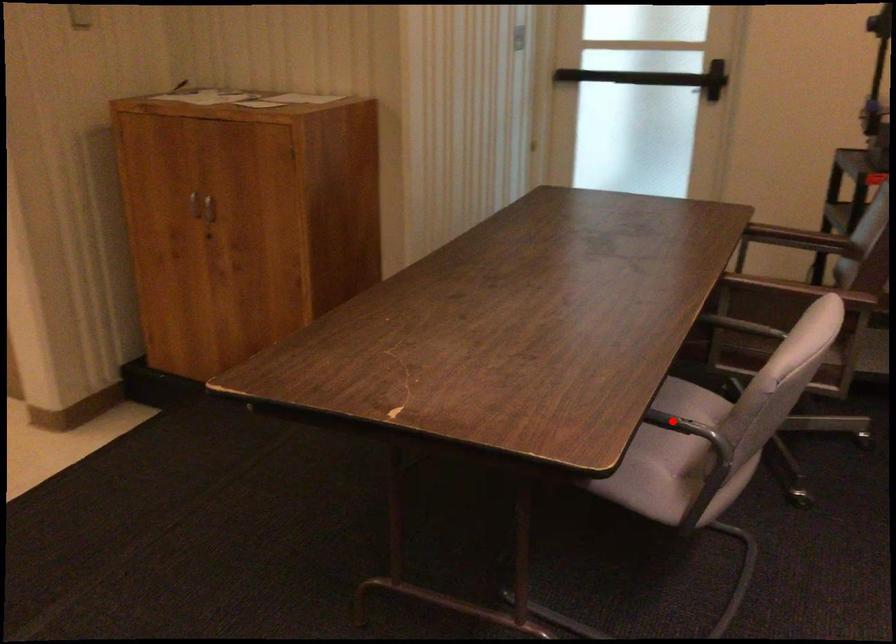
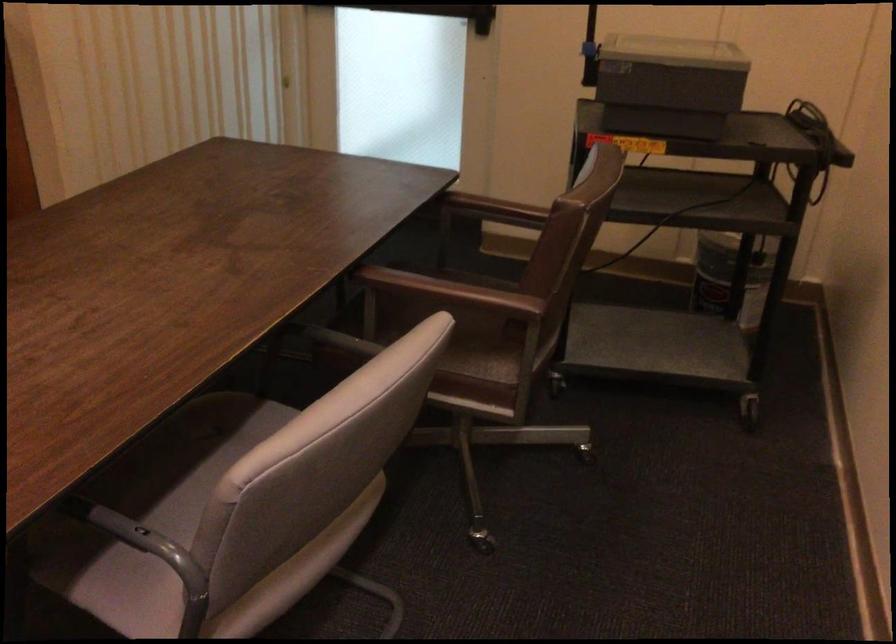
In the second image, find the point that corresponds to the highlighted location in the first image.

(140, 538)